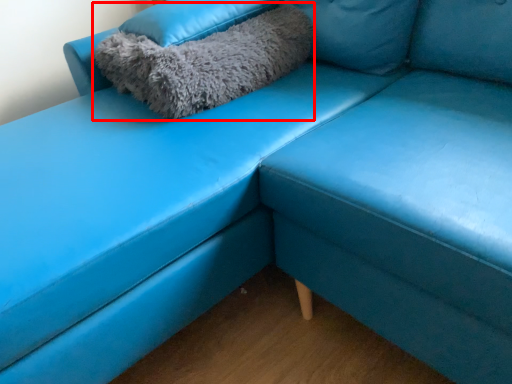
Question: From the image's perspective, what is the correct spatial relationship of pillow (annotated by the red box) in relation to pillow?

Choices:
 (A) below
 (B) above

Answer: (A)